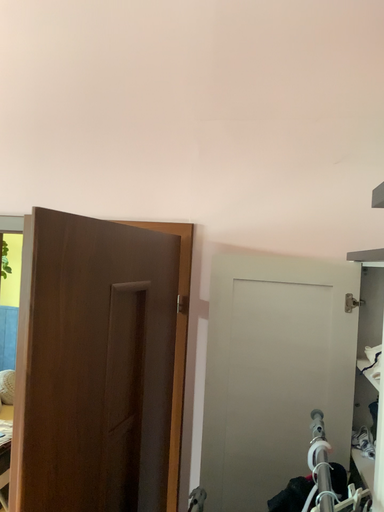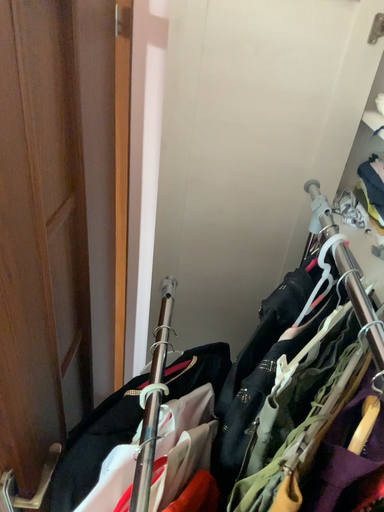
Question: Which way did the camera rotate in the video?

Choices:
 (A) rotated right
 (B) rotated left

Answer: (A)